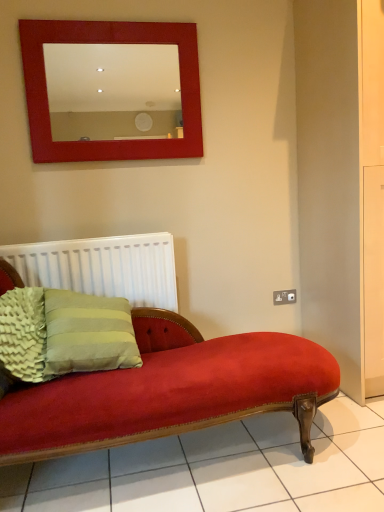
The image size is (384, 512). Identify the location of satin silver outlet at lower right. (284, 297).

This screenshot has width=384, height=512. What are the coordinates of `white plastic radiator at lower left` in the screenshot? It's located at (103, 267).

How many degrees apart are the facing directions of green textured pillow at lower left and satin silver outlet at lower right?

The facing directions of green textured pillow at lower left and satin silver outlet at lower right are 76.9 degrees apart.

From a real-world perspective, is green textured pillow at lower left beneath satin silver outlet at lower right?

No, from a real-world perspective, green textured pillow at lower left is not under satin silver outlet at lower right.

How distant is green textured pillow at lower left from satin silver outlet at lower right?

green textured pillow at lower left is 4.66 feet away from satin silver outlet at lower right.

Considering the relative positions of green textured pillow at lower left and satin silver outlet at lower right in the image provided, is green textured pillow at lower left to the left of satin silver outlet at lower right from the viewer's perspective?

Correct, you'll find green textured pillow at lower left to the left of satin silver outlet at lower right.

Considering the sizes of objects satin silver outlet at lower right and white plastic radiator at lower left in the image provided, who is bigger, satin silver outlet at lower right or white plastic radiator at lower left?

white plastic radiator at lower left.

What's the angular difference between satin silver outlet at lower right and white plastic radiator at lower left's facing directions?

The facing directions of satin silver outlet at lower right and white plastic radiator at lower left are 2.46 degrees apart.

Is satin silver outlet at lower right taller than white plastic radiator at lower left?

Incorrect, the height of satin silver outlet at lower right is not larger of that of white plastic radiator at lower left.

Looking at this image, from a real-world perspective, is satin silver outlet at lower right positioned under white plastic radiator at lower left based on gravity?

Correct, in the physical world, satin silver outlet at lower right is lower than white plastic radiator at lower left.

Measure the distance between green textured pillow at lower left and white plastic radiator at lower left.

green textured pillow at lower left is 17.04 inches from white plastic radiator at lower left.

Is green textured pillow at lower left not close to white plastic radiator at lower left?

No, green textured pillow at lower left is not far away from white plastic radiator at lower left.

Considering the relative positions of green textured pillow at lower left and white plastic radiator at lower left in the image provided, is green textured pillow at lower left in front of white plastic radiator at lower left?

Yes.

From the image's perspective, is green textured pillow at lower left located above or below white plastic radiator at lower left?

Clearly, from the image's perspective, green textured pillow at lower left is below white plastic radiator at lower left.

From the image's perspective, who appears lower, white plastic radiator at lower left or satin silver outlet at lower right?

satin silver outlet at lower right is shown below in the image.

From a real-world perspective, is white plastic radiator at lower left positioned under satin silver outlet at lower right based on gravity?

No, from a real-world perspective, white plastic radiator at lower left is not below satin silver outlet at lower right.

Is white plastic radiator at lower left placed right next to satin silver outlet at lower right?

No, white plastic radiator at lower left is not with satin silver outlet at lower right.

Does white plastic radiator at lower left have a smaller size compared to satin silver outlet at lower right?

Incorrect, white plastic radiator at lower left is not smaller in size than satin silver outlet at lower right.

Does white plastic radiator at lower left lie in front of green textured pillow at lower left?

No, white plastic radiator at lower left is behind green textured pillow at lower left.

Is white plastic radiator at lower left oriented towards green textured pillow at lower left?

Yes, white plastic radiator at lower left is oriented towards green textured pillow at lower left.

Based on the photo, considering the sizes of white plastic radiator at lower left and green textured pillow at lower left in the image, is white plastic radiator at lower left wider or thinner than green textured pillow at lower left?

white plastic radiator at lower left is thinner than green textured pillow at lower left.

Is there a large distance between white plastic radiator at lower left and green textured pillow at lower left?

No, there isn't a large distance between white plastic radiator at lower left and green textured pillow at lower left.

Looking at this image, is green textured pillow at lower left at the back of satin silver outlet at lower right?

No, satin silver outlet at lower right is not facing away from green textured pillow at lower left.

Which is more to the right, satin silver outlet at lower right or green textured pillow at lower left?

From the viewer's perspective, satin silver outlet at lower right appears more on the right side.

Considering the relative sizes of satin silver outlet at lower right and green textured pillow at lower left in the image provided, is satin silver outlet at lower right bigger than green textured pillow at lower left?

Incorrect, satin silver outlet at lower right is not larger than green textured pillow at lower left.

In order to click on pillow lying on the left of satin silver outlet at lower right in this screenshot , I will do `click(24, 334)`.

The width and height of the screenshot is (384, 512). I want to click on pillow on the left of the satin silver outlet at lower right, so (x=24, y=334).

In the image, there is a satin silver outlet at lower right. Where is `radiator above it (from the image's perspective)`? This screenshot has height=512, width=384. radiator above it (from the image's perspective) is located at coordinates (103, 267).

Considering their positions, is satin silver outlet at lower right positioned further to white plastic radiator at lower left than green textured pillow at lower left?

satin silver outlet at lower right.

Looking at the image, which one is located closer to satin silver outlet at lower right, green textured pillow at lower left or white plastic radiator at lower left?

Based on the image, white plastic radiator at lower left appears to be nearer to satin silver outlet at lower right.

Which object lies nearer to the anchor point white plastic radiator at lower left, green textured pillow at lower left or satin silver outlet at lower right?

green textured pillow at lower left is closer to white plastic radiator at lower left.

Estimate the real-world distances between objects in this image. Which object is closer to green textured pillow at lower left, white plastic radiator at lower left or satin silver outlet at lower right?

white plastic radiator at lower left lies closer to green textured pillow at lower left than the other object.

Considering their positions, is satin silver outlet at lower right positioned further to green textured pillow at lower left than white plastic radiator at lower left?

satin silver outlet at lower right is further to green textured pillow at lower left.

When comparing their distances from satin silver outlet at lower right, does white plastic radiator at lower left or green textured pillow at lower left seem closer?

The object closer to satin silver outlet at lower right is white plastic radiator at lower left.

At what (x,y) coordinates should I click in order to perform the action: click on radiator between green textured pillow at lower left and satin silver outlet at lower right in the horizontal direction. Please return your answer as a coordinate pair (x, y). The height and width of the screenshot is (512, 384). Looking at the image, I should click on 103,267.